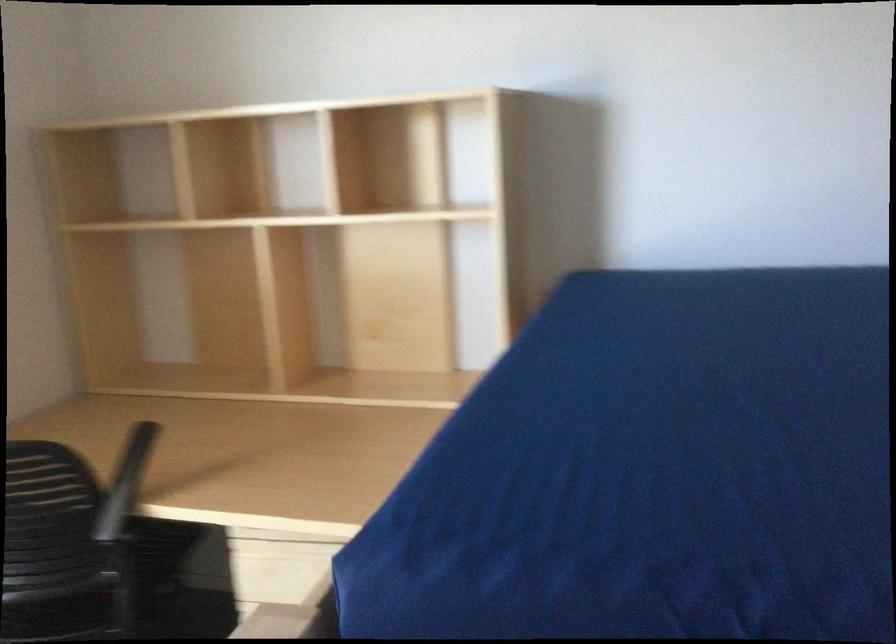
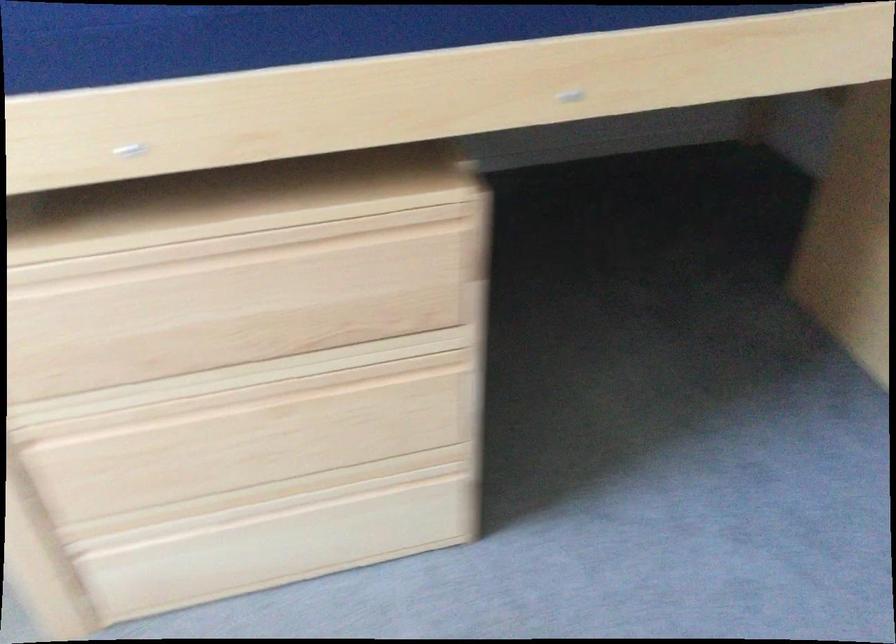
The first image is from the beginning of the video and the second image is from the end. How did the camera likely rotate when shooting the video?

The camera rotated toward right-down.